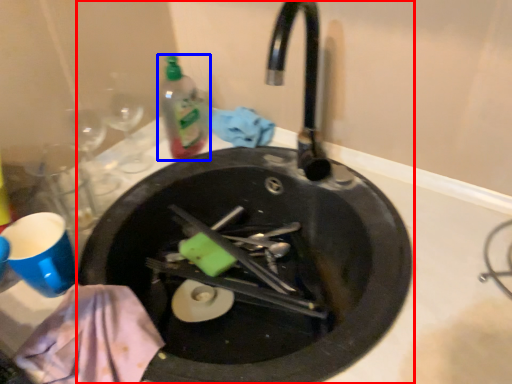
Question: Which object appears farthest to the camera in this image, sink (highlighted by a red box) or bottle (highlighted by a blue box)?

Choices:
 (A) sink
 (B) bottle

Answer: (B)